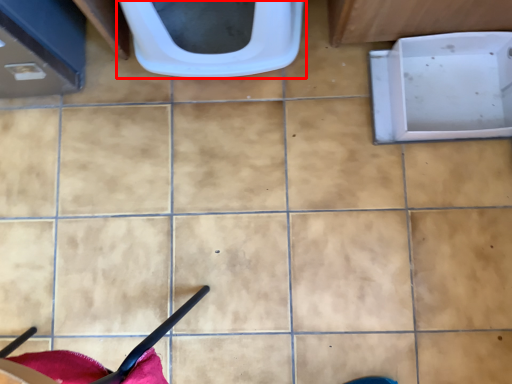
Question: From the image, what is the correct spatial relationship of toilet (annotated by the red box) in relation to bath?

Choices:
 (A) right
 (B) left

Answer: (B)